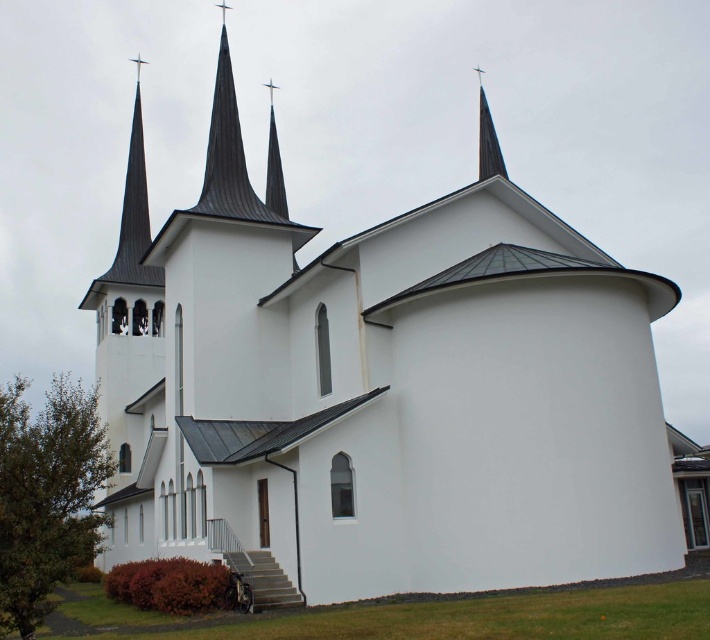
You are an architect analyzing the church building. You need to determine which spire has a greater width between the shiny metallic spire at upper center and the shiny silver spire at center. Which one is wider?

The shiny metallic spire at upper center is wider than the shiny silver spire at center.